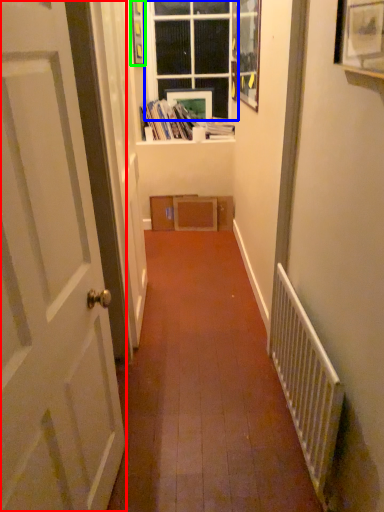
Question: Which is farther away from door (highlighted by a red box)? window (highlighted by a blue box) or picture frame (highlighted by a green box)?

Choices:
 (A) window
 (B) picture frame

Answer: (A)